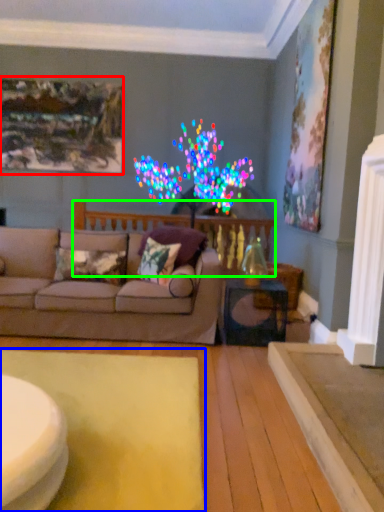
Question: Which object is the closest to the picture frame (highlighted by a red box)? Choose among these: mat (highlighted by a blue box) or balustrade (highlighted by a green box).

Choices:
 (A) mat
 (B) balustrade

Answer: (B)